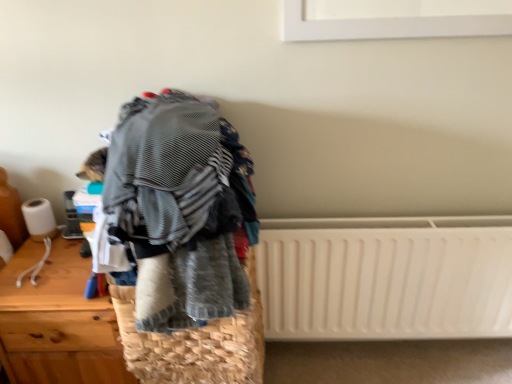
Identify the location of free space above wooden chest of drawers at left (from a real-world perspective). This screenshot has height=384, width=512. (51, 269).